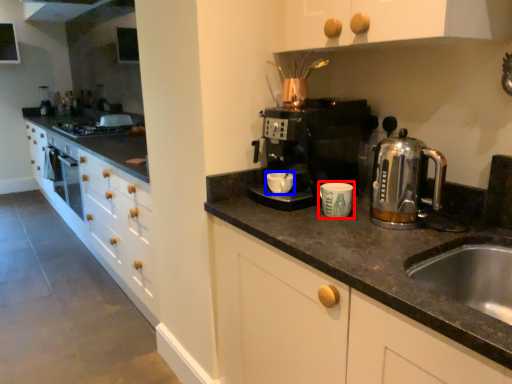
Question: Among these objects, which one is nearest to the camera, kitchen appliance (highlighted by a red box) or mug (highlighted by a blue box)?

Choices:
 (A) kitchen appliance
 (B) mug

Answer: (A)